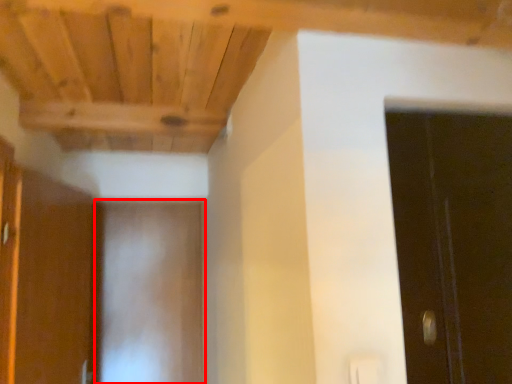
Question: From the image's perspective, what is the correct spatial positioning of door (annotated by the red box) in reference to cabinetry?

Choices:
 (A) above
 (B) below

Answer: (B)